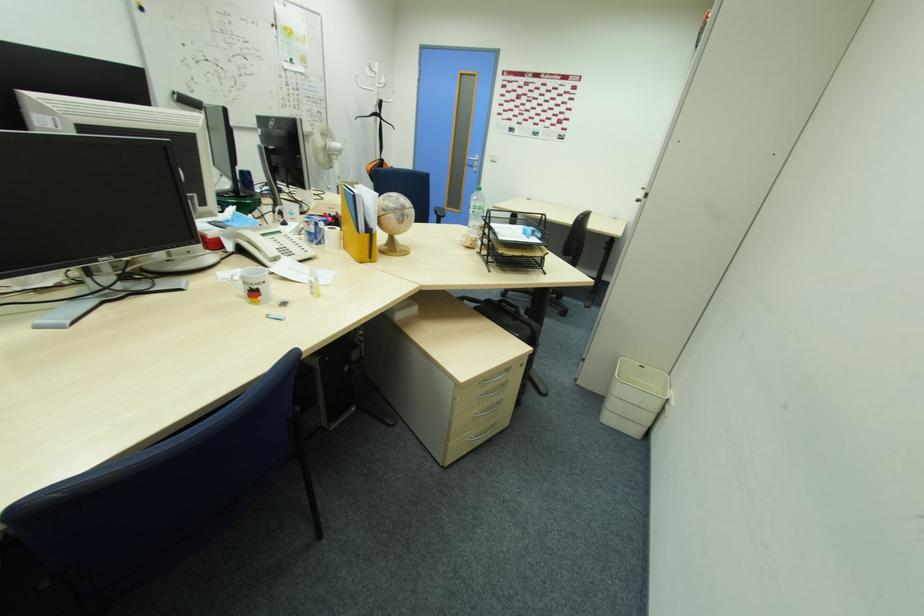
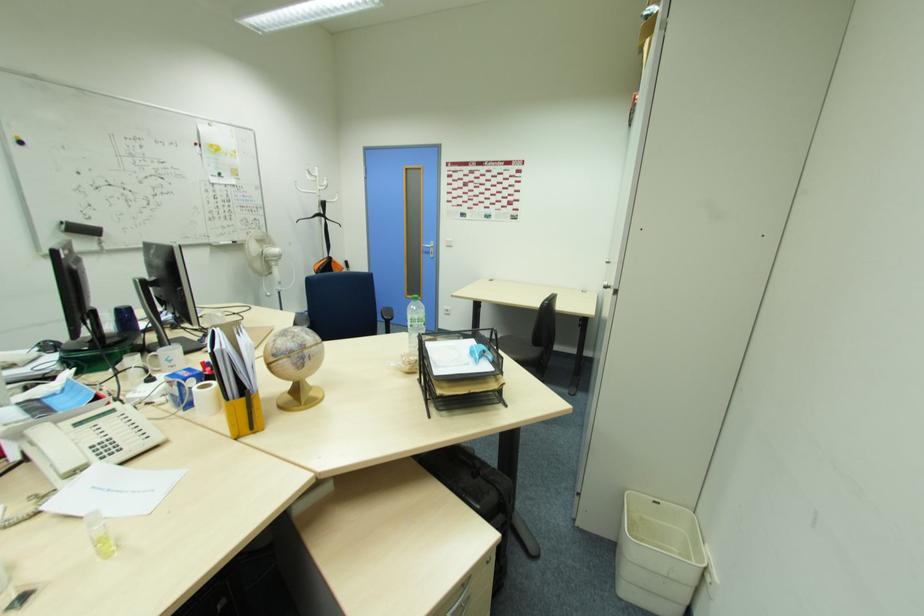
Where in the second image is the point corresponding to pixel 408 207 from the first image?

(309, 346)